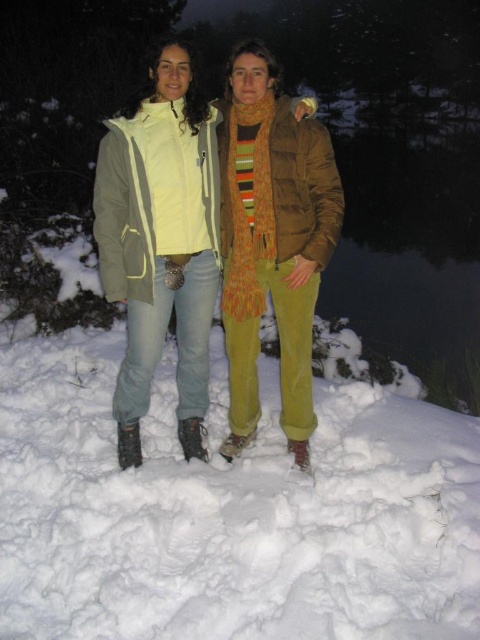
Can you confirm if matte yellow jacket at center is thinner than brown suede jacket at center?

No, matte yellow jacket at center is not thinner than brown suede jacket at center.

Which is in front, point (126, 426) or point (231, 154)?

Positioned in front is point (231, 154).

I want to click on matte yellow jacket at center, so click(x=162, y=240).